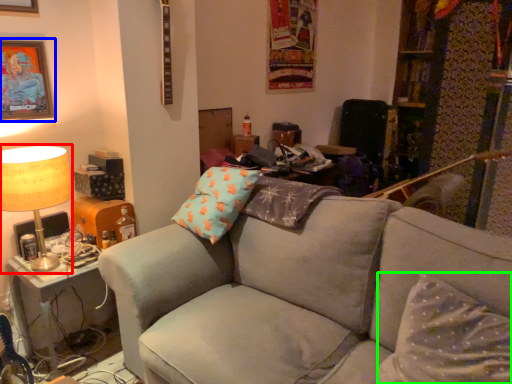
Question: Which object is the closest to the table lamp (highlighted by a red box)? Choose among these: picture frame (highlighted by a blue box) or pillow (highlighted by a green box).

Choices:
 (A) picture frame
 (B) pillow

Answer: (A)